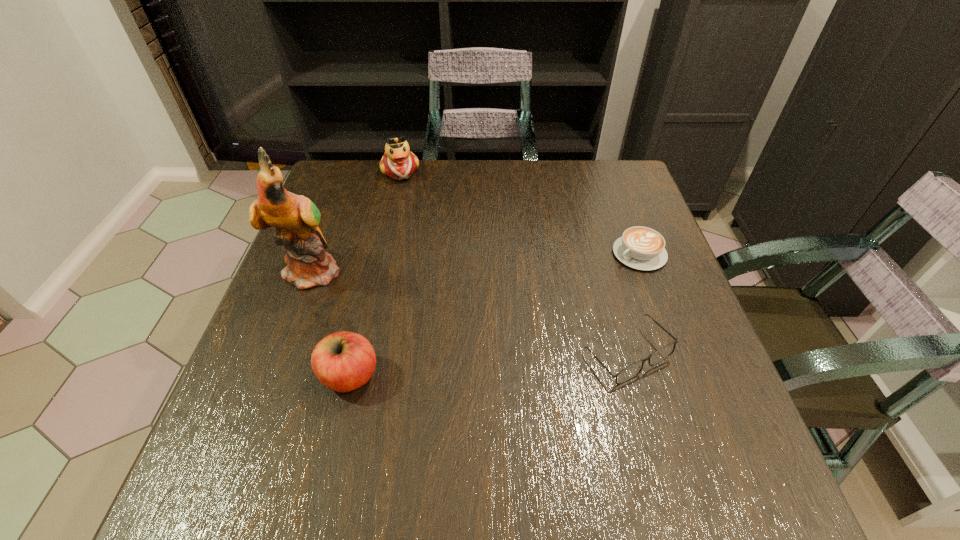
Locate an element on the screen. parrot that is at the left edge is located at coordinates (296, 218).

I want to click on spectacles at the right edge, so click(633, 370).

The height and width of the screenshot is (540, 960). I want to click on cappuccino located at the right edge, so click(x=642, y=248).

The width and height of the screenshot is (960, 540). What are the coordinates of `object that is at the far left corner` in the screenshot? It's located at (398, 162).

The width and height of the screenshot is (960, 540). What are the coordinates of `object present at the near left corner` in the screenshot? It's located at (343, 361).

In the image, there is a desktop. At what (x,y) coordinates should I click in order to perform the action: click on vacant space at the far edge. Please return your answer as a coordinate pair (x, y). Image resolution: width=960 pixels, height=540 pixels. Looking at the image, I should click on (436, 187).

Where is `vacant space at the near edge`? vacant space at the near edge is located at coordinates (387, 424).

Locate an element on the screen. The width and height of the screenshot is (960, 540). free spot at the left edge of the desktop is located at coordinates (307, 345).

The height and width of the screenshot is (540, 960). I want to click on free space at the right edge of the desktop, so click(x=591, y=218).

At what (x,y) coordinates should I click in order to perform the action: click on vacant area at the far left corner. Please return your answer as a coordinate pair (x, y). Looking at the image, I should click on (341, 194).